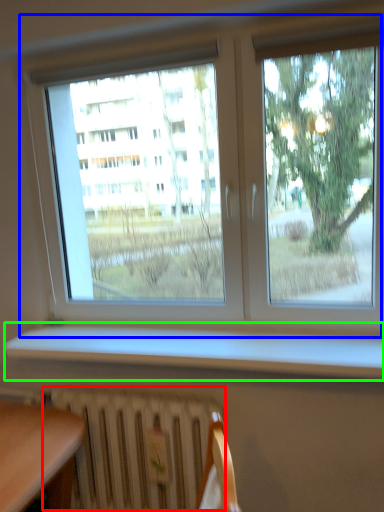
Question: Which object is positioned closest to radiator (highlighted by a red box)? Select from window (highlighted by a blue box) and window sill (highlighted by a green box).

Choices:
 (A) window
 (B) window sill

Answer: (B)